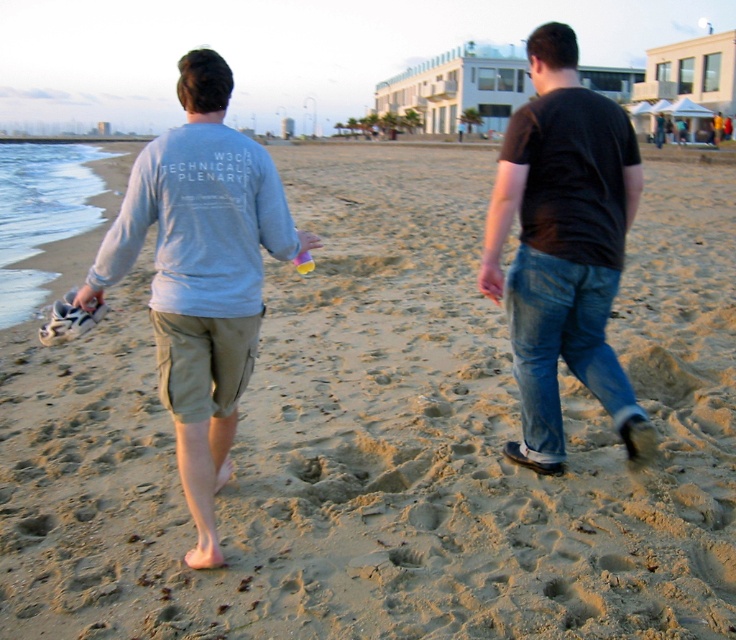
The height and width of the screenshot is (640, 736). Find the location of `light gray cotton shirt at left`. light gray cotton shirt at left is located at coordinates (201, 273).

Find the location of a particular element. The height and width of the screenshot is (640, 736). light gray cotton shirt at left is located at coordinates pos(201,273).

Between light gray cotton shirt at left and black cotton shirt at right, which one is positioned lower?

light gray cotton shirt at left is lower down.

Is light gray cotton shirt at left positioned before black cotton shirt at right?

Yes, light gray cotton shirt at left is in front of black cotton shirt at right.

Between point (174, 166) and point (531, 416), which one is positioned behind?

The point (531, 416) is behind.

Where is `light gray cotton shirt at left`? This screenshot has width=736, height=640. light gray cotton shirt at left is located at coordinates (201, 273).

Which is below, black cotton shirt at right or matte black t-shirt at upper right?

black cotton shirt at right is lower down.

Is black cotton shirt at right bigger than matte black t-shirt at upper right?

Yes, black cotton shirt at right is bigger than matte black t-shirt at upper right.

Image resolution: width=736 pixels, height=640 pixels. What do you see at coordinates (562, 246) in the screenshot? I see `black cotton shirt at right` at bounding box center [562, 246].

Identify the location of black cotton shirt at right. This screenshot has height=640, width=736. (562, 246).